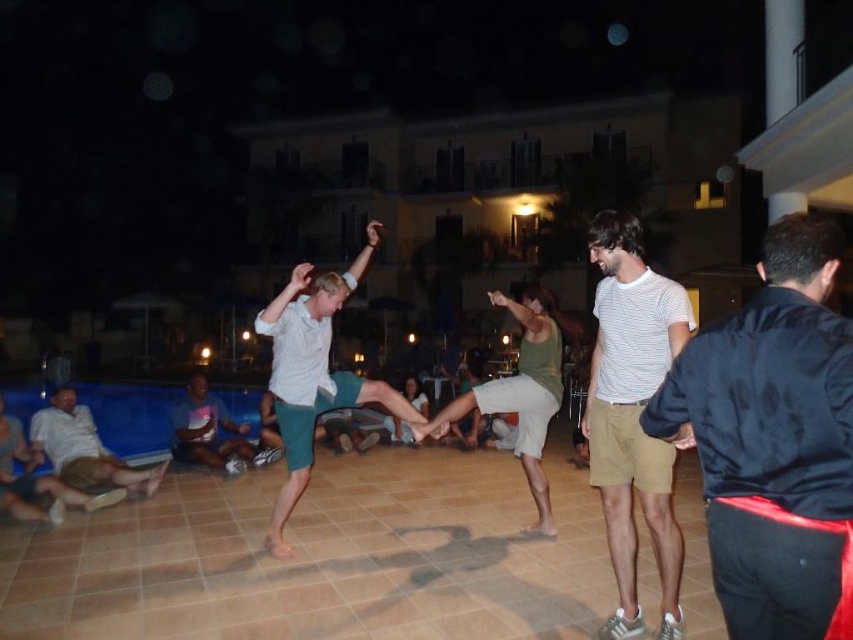
Question: Can you confirm if striped cotton shirt at center is positioned to the right of light brown fabric shorts at lower left?

Choices:
 (A) no
 (B) yes

Answer: (B)

Question: Estimate the real-world distances between objects in this image. Which object is closer to the light brown fabric shorts at lower left?

Choices:
 (A) dark blue satin jacket at right
 (B) striped cotton shirt at center
 (C) dark blue t-shirt at lower left

Answer: (C)

Question: Which of these objects is positioned farthest from the dark blue satin jacket at right?

Choices:
 (A) light brown fabric shorts at lower left
 (B) dark blue t-shirt at lower left
 (C) striped cotton shirt at center

Answer: (B)

Question: Is the position of light brown fabric shorts at lower left more distant than that of dark blue t-shirt at lower left?

Choices:
 (A) yes
 (B) no

Answer: (B)

Question: Is light brown fabric shorts at lower left bigger than dark blue t-shirt at lower left?

Choices:
 (A) yes
 (B) no

Answer: (B)

Question: Among these objects, which one is farthest from the camera?

Choices:
 (A) striped cotton shirt at center
 (B) dark blue satin jacket at right
 (C) dark blue t-shirt at lower left

Answer: (C)